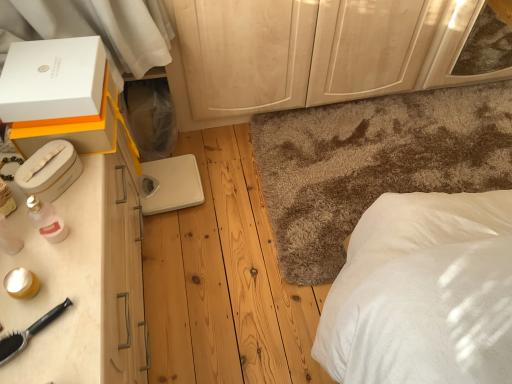
Identify the location of vacant space positioned to the left of pink glass perfume at left. Image resolution: width=512 pixels, height=384 pixels. (19, 231).